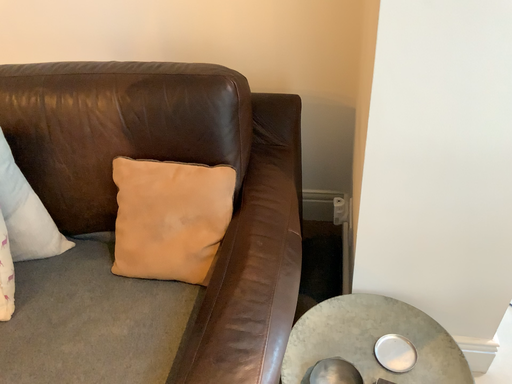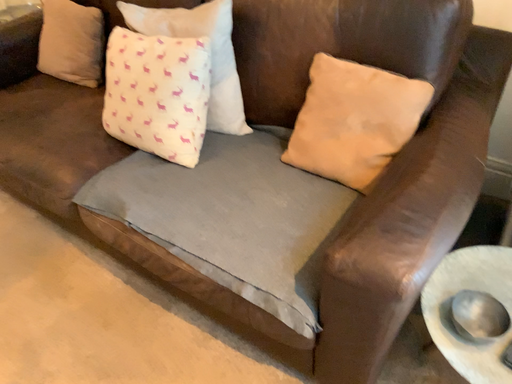
Question: How did the camera likely rotate when shooting the video?

Choices:
 (A) rotated left
 (B) rotated right

Answer: (A)